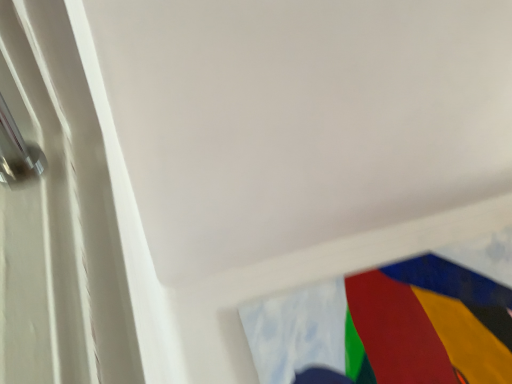
What do you see at coordinates (388, 326) in the screenshot? The height and width of the screenshot is (384, 512). I see `textured fabric flag at lower right` at bounding box center [388, 326].

Measure the distance between textured fabric flag at lower right and camera.

They are 5.52 feet apart.

Locate an element on the screen. This screenshot has height=384, width=512. textured fabric flag at lower right is located at coordinates (388, 326).

I want to click on textured fabric flag at lower right, so click(x=388, y=326).